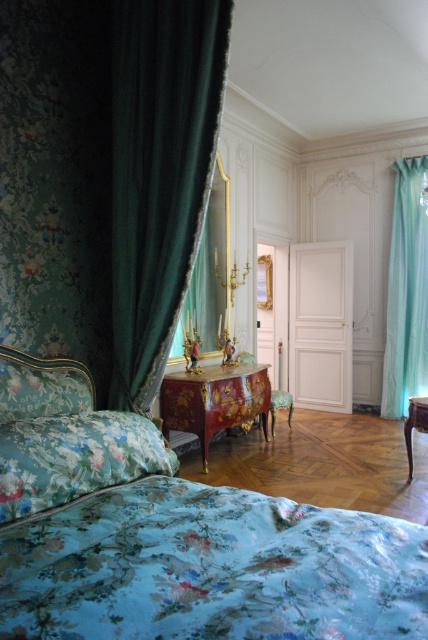
You are an interior designer assessing the space in this bedroom. You need to determine if the floral fabric bed at lower left can be moved closer to the velvet dark green curtain at left without overlapping. Can you confirm if there is enough space between them?

The floral fabric bed at lower left is bigger than the velvet dark green curtain at left, so there is sufficient space between them to move the bed closer without overlapping.

You are standing in the center of the luxurious bedroom and notice the velvet dark green curtain at left. Based on its position, can you estimate whether it is closer to the bed or the ornate red and gold commode?

The velvet dark green curtain at left is located at point (x=158, y=173), which places it closer to the bed than the ornate red and gold commode.